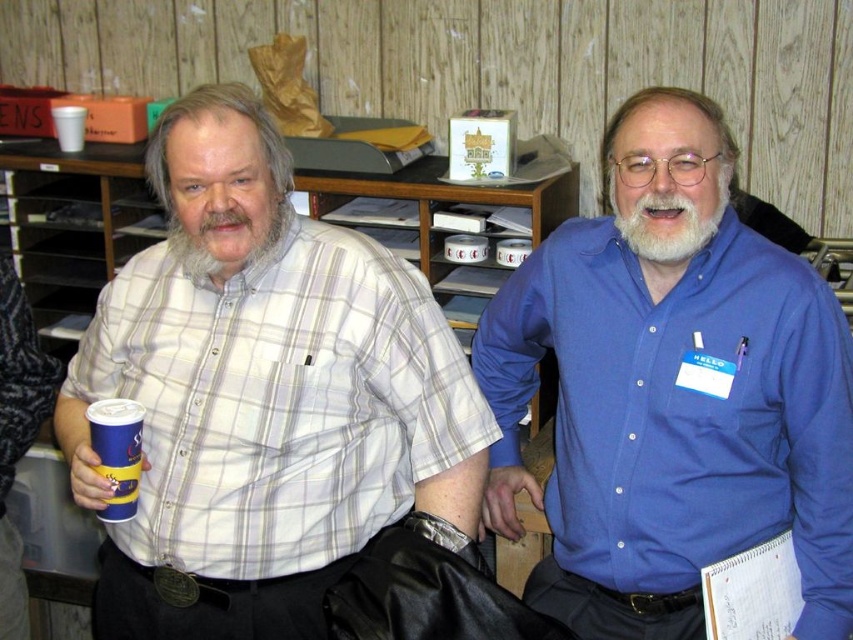
Is point (761, 506) less distant than point (642, 212)?

No, (761, 506) is behind (642, 212).

Between point (583, 324) and point (663, 244), which one is positioned in front?

Point (663, 244) is in front.

Between point (747, 328) and point (643, 232), which one is positioned in front?

Point (643, 232) is more forward.

I want to click on blue button-up shirt at center, so click(672, 397).

Can you confirm if grayhairbeard at center is wider than whitehairbeard at center?

Yes, grayhairbeard at center is wider than whitehairbeard at center.

Which is more to the left, grayhairbeard at center or whitehairbeard at center?

Positioned to the left is grayhairbeard at center.

This screenshot has width=853, height=640. Describe the element at coordinates (229, 241) in the screenshot. I see `grayhairbeard at center` at that location.

Locate an element on the screen. grayhairbeard at center is located at coordinates (229, 241).

Does grayhairbeard at center have a larger size compared to blue paper cup at left?

Yes, grayhairbeard at center is bigger than blue paper cup at left.

Is grayhairbeard at center below blue paper cup at left?

No, grayhairbeard at center is not below blue paper cup at left.

Is point (225, 230) closer to viewer compared to point (113, 467)?

No, it is behind (113, 467).

Locate an element on the screen. This screenshot has height=640, width=853. grayhairbeard at center is located at coordinates (229, 241).